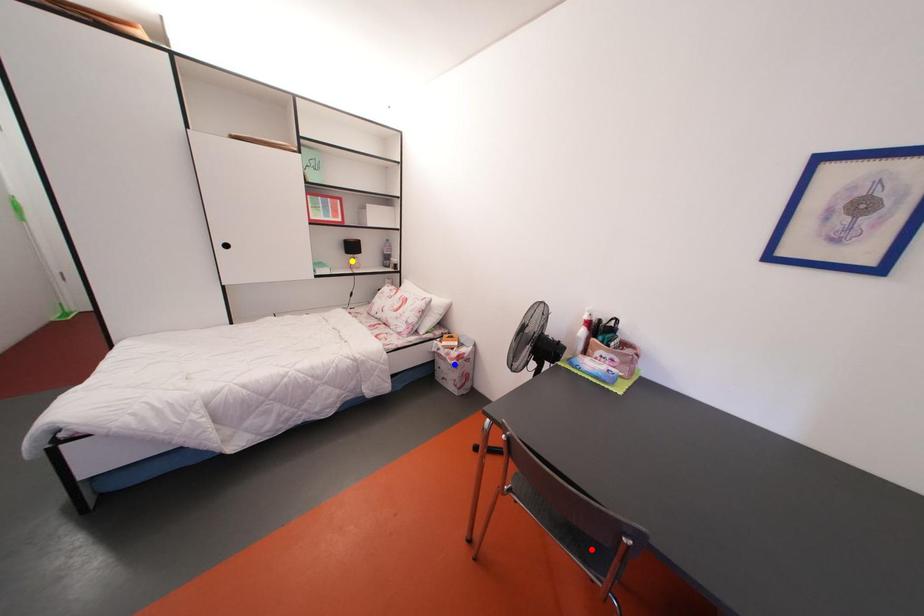
Looking at this image, order these from nearest to farthest:
blue point | yellow point | red point

red point, blue point, yellow point